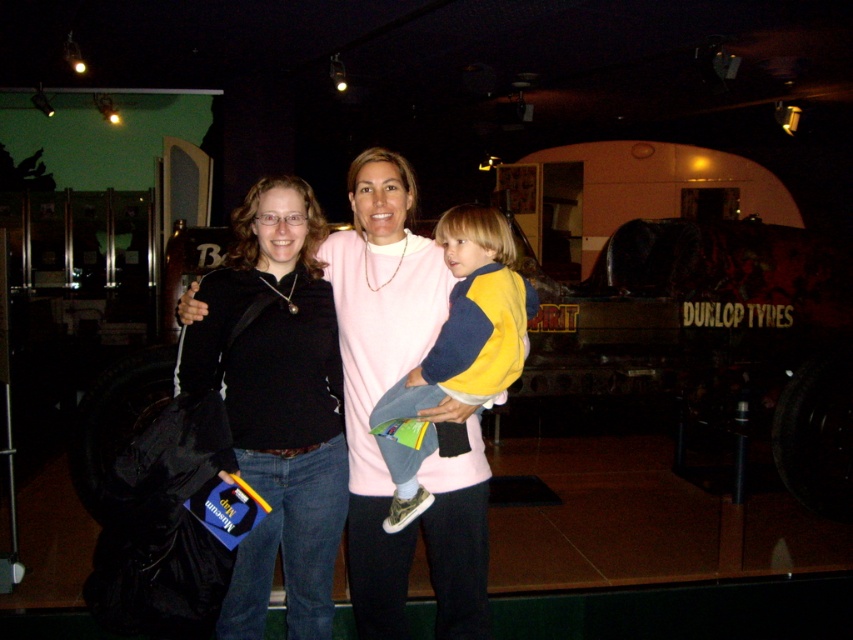
In the scene shown: Who is more forward, (364, 368) or (474, 326)?

Positioned in front is point (474, 326).

Is pink matte sweater at center wider than yellow-blue sweater at center?

Correct, the width of pink matte sweater at center exceeds that of yellow-blue sweater at center.

Who is more forward, (465, 611) or (375, 419)?

Point (375, 419) is in front.

The width and height of the screenshot is (853, 640). I want to click on pink matte sweater at center, so click(x=380, y=364).